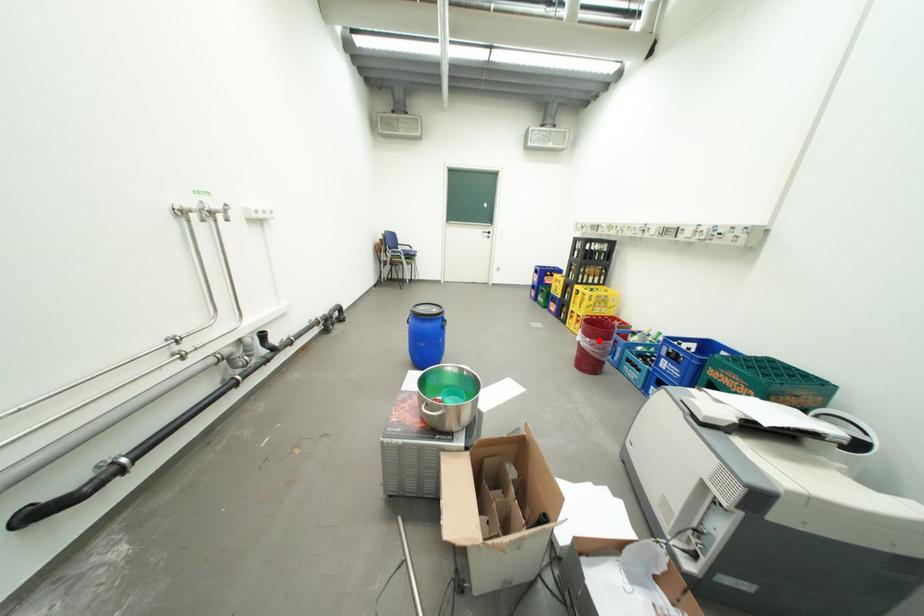
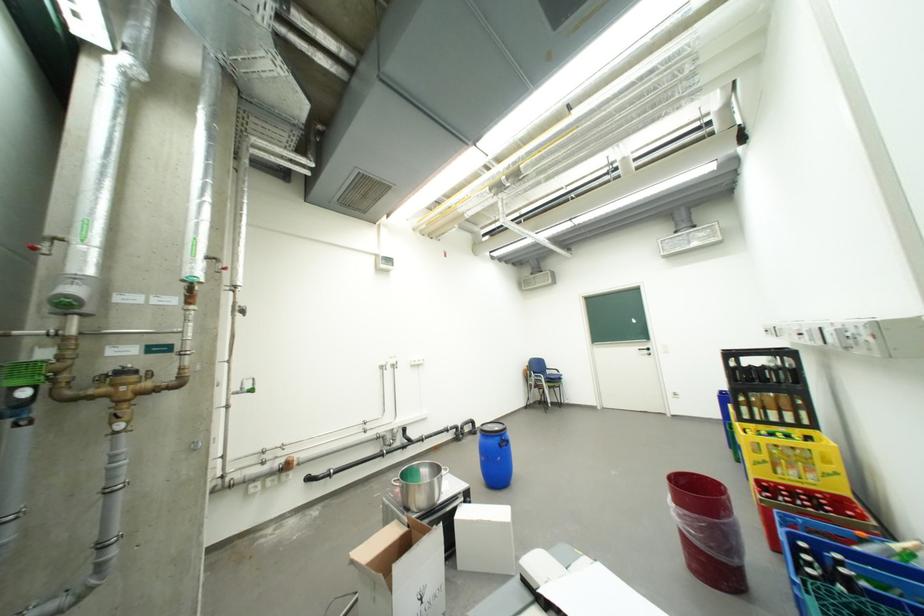
Find the pixel in the second image that matches the highlighted location in the first image.

(685, 507)